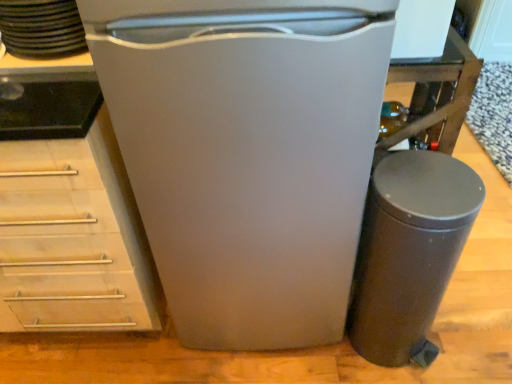
What is the approximate width of white matte refrigerator at center?

23.94 inches.

Looking at this image, measure the distance between point (50, 44) and camera.

Point (50, 44) and camera are 39.21 inches apart.

In order to face black matte stack of plates at upper left, should I rotate leftwards or rightwards?

A 25.862 degree turn to the left will do.

At what (x,y) coordinates should I click in order to perform the action: click on matte black trash can at lower right. Please return your answer as a coordinate pair (x, y). Looking at the image, I should click on (409, 252).

Locate an element on the screen. This screenshot has height=384, width=512. white matte refrigerator at center is located at coordinates (247, 154).

Would you say matte black trash can at lower right is a long distance from white matte refrigerator at center?

That's not correct — matte black trash can at lower right is a little close to white matte refrigerator at center.

Does matte black trash can at lower right appear on the right side of white matte refrigerator at center?

Yes, matte black trash can at lower right is to the right of white matte refrigerator at center.

Considering the positions of point (378, 234) and point (213, 84), is point (378, 234) closer or farther from the camera than point (213, 84)?

Point (378, 234) is farther from the camera than point (213, 84).

How many degrees apart are the facing directions of matte black trash can at lower right and white matte refrigerator at center?

92.9 degrees.

Is black matte stack of plates at upper left not close to white matte refrigerator at center?

black matte stack of plates at upper left is near white matte refrigerator at center, not far away.

Does black matte stack of plates at upper left have a greater height compared to white matte refrigerator at center?

No.

From the image's perspective, which one is positioned lower, black matte stack of plates at upper left or white matte refrigerator at center?

white matte refrigerator at center appears lower in the image.

Locate an element on the screen. The image size is (512, 384). home appliance that is in front of the black matte stack of plates at upper left is located at coordinates (247, 154).

From a real-world perspective, who is located higher, white matte refrigerator at center or matte black trash can at lower right?

white matte refrigerator at center, from a real-world perspective.

Can you confirm if white matte refrigerator at center is shorter than matte black trash can at lower right?

No.

Between white matte refrigerator at center and matte black trash can at lower right, which one is positioned behind?

matte black trash can at lower right is further away from the camera.

Considering the points (298, 107) and (421, 259), which point is in front, point (298, 107) or point (421, 259)?

The point (298, 107) is closer.

How different are the orientations of black matte stack of plates at upper left and matte black trash can at lower right in degrees?

The angular difference between black matte stack of plates at upper left and matte black trash can at lower right is 87.6 degrees.

At what (x,y) coordinates should I click in order to perform the action: click on appliance that is on the left side of matte black trash can at lower right. Please return your answer as a coordinate pair (x, y). This screenshot has width=512, height=384. Looking at the image, I should click on (41, 28).

From a real-world perspective, is black matte stack of plates at upper left physically below matte black trash can at lower right?

No, from a real-world perspective, black matte stack of plates at upper left is not beneath matte black trash can at lower right.

Is black matte stack of plates at upper left shorter than matte black trash can at lower right?

Indeed, black matte stack of plates at upper left has a lesser height compared to matte black trash can at lower right.

Considering the points (413, 283) and (58, 1), which point is in front, point (413, 283) or point (58, 1)?

The point (58, 1) is more forward.

From the image's perspective, is matte black trash can at lower right above or below black matte stack of plates at upper left?

Based on their image positions, matte black trash can at lower right is located beneath black matte stack of plates at upper left.

Is the position of matte black trash can at lower right more distant than that of black matte stack of plates at upper left?

No, it is in front of black matte stack of plates at upper left.

You are a GUI agent. You are given a task and a screenshot of the screen. Output one action in this format:
    pyautogui.click(x=<x>, y=<y>)
    Task: Click on the waste container in front of the black matte stack of plates at upper left
    
    Given the screenshot: What is the action you would take?
    pyautogui.click(x=409, y=252)

From a real-world perspective, is white matte refrigerator at center physically above black matte stack of plates at upper left?

Incorrect, from a real-world perspective, white matte refrigerator at center is lower than black matte stack of plates at upper left.

Could you tell me if white matte refrigerator at center is turned towards black matte stack of plates at upper left?

No, white matte refrigerator at center is not aimed at black matte stack of plates at upper left.

Is point (248, 315) closer or farther from the camera than point (45, 39)?

Point (248, 315) is farther from the camera than point (45, 39).

Can you confirm if white matte refrigerator at center is taller than black matte stack of plates at upper left?

Yes.

Identify the location of home appliance located above the matte black trash can at lower right (from the image's perspective). Image resolution: width=512 pixels, height=384 pixels. (247, 154).

The image size is (512, 384). I want to click on home appliance that is in front of the black matte stack of plates at upper left, so click(x=247, y=154).

Based on their spatial positions, is black matte stack of plates at upper left or white matte refrigerator at center closer to matte black trash can at lower right?

Based on the image, white matte refrigerator at center appears to be nearer to matte black trash can at lower right.

Consider the image. From the image, which object appears to be farther from black matte stack of plates at upper left, white matte refrigerator at center or matte black trash can at lower right?

The object further to black matte stack of plates at upper left is matte black trash can at lower right.

Looking at the image, which one is located further to matte black trash can at lower right, white matte refrigerator at center or black matte stack of plates at upper left?

Based on the image, black matte stack of plates at upper left appears to be further to matte black trash can at lower right.

In the scene shown: Estimate the real-world distances between objects in this image. Which object is further from white matte refrigerator at center, matte black trash can at lower right or black matte stack of plates at upper left?

black matte stack of plates at upper left lies further to white matte refrigerator at center than the other object.

Considering their positions, is matte black trash can at lower right positioned further to black matte stack of plates at upper left than white matte refrigerator at center?

Among the two, matte black trash can at lower right is located further to black matte stack of plates at upper left.

Estimate the real-world distances between objects in this image. Which object is closer to white matte refrigerator at center, black matte stack of plates at upper left or matte black trash can at lower right?

matte black trash can at lower right is closer to white matte refrigerator at center.

Locate an element on the screen. home appliance between black matte stack of plates at upper left and matte black trash can at lower right from left to right is located at coordinates (247, 154).